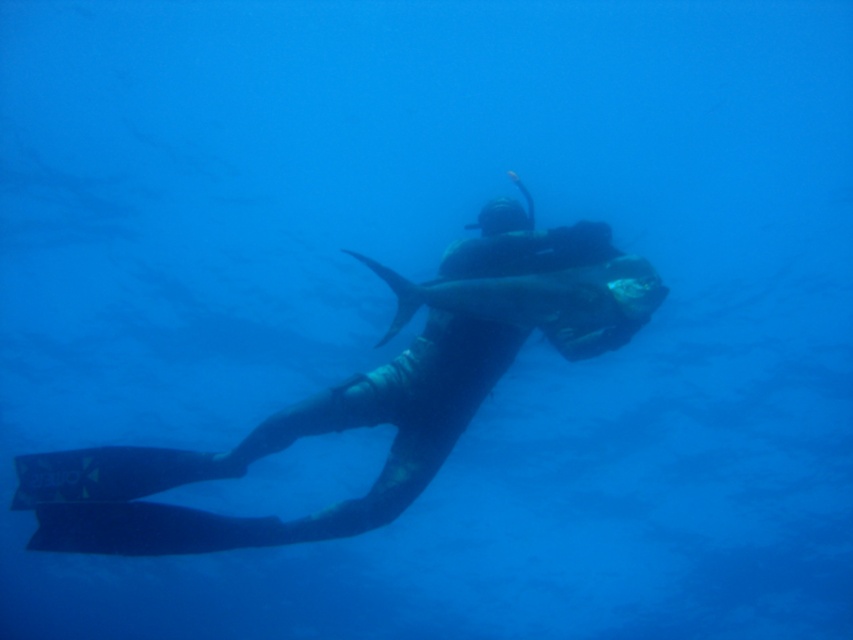
Which is in front, point (485, 236) or point (622, 284)?

Point (622, 284) is more forward.

Who is lower down, black rubber wetsuit at center or shiny silver fish at center?

black rubber wetsuit at center is lower down.

Describe the element at coordinates (276, 451) in the screenshot. This screenshot has width=853, height=640. I see `black rubber wetsuit at center` at that location.

Locate an element on the screen. This screenshot has height=640, width=853. black rubber wetsuit at center is located at coordinates (276, 451).